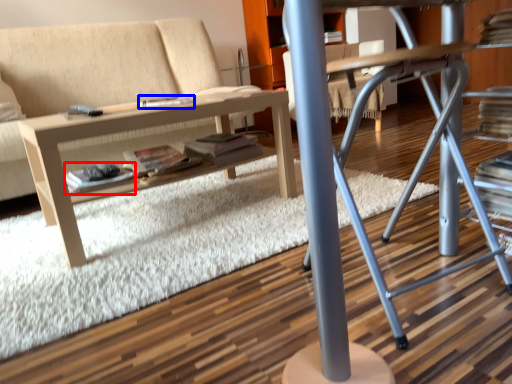
Question: Which object appears farthest to the camera in this image, paperback book (highlighted by a red box) or magazine (highlighted by a blue box)?

Choices:
 (A) paperback book
 (B) magazine

Answer: (B)